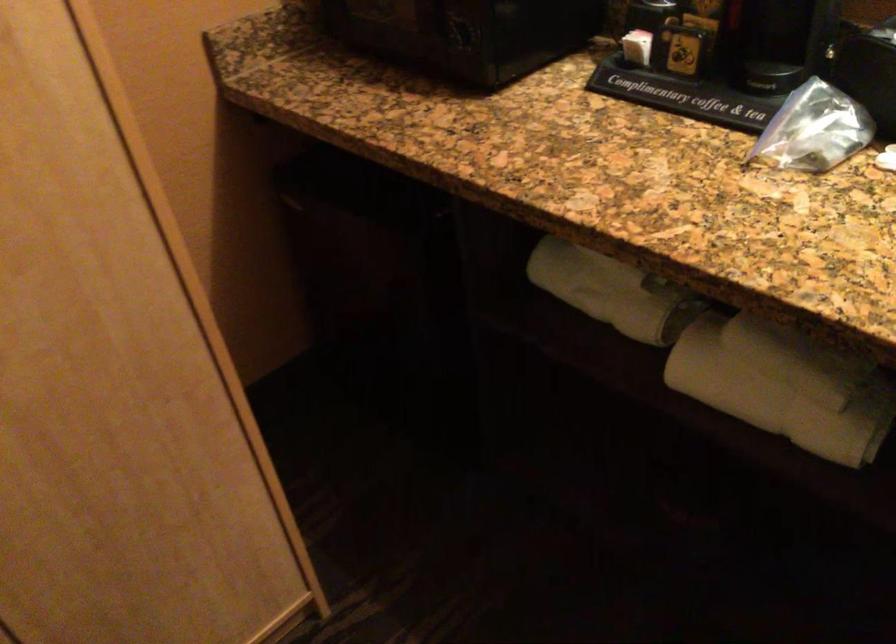
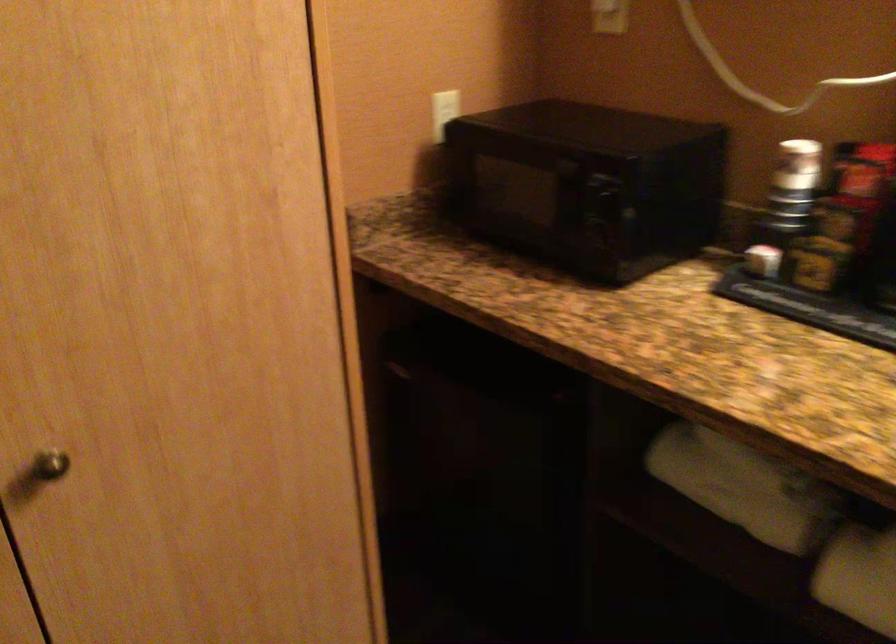
Where in the second image is the point corresponding to point (710, 368) from the first image?

(858, 576)